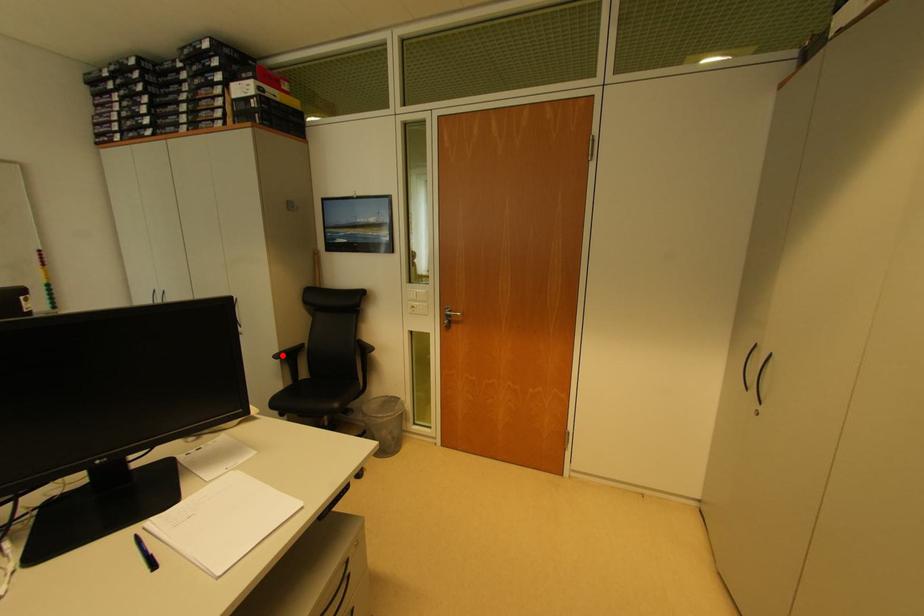
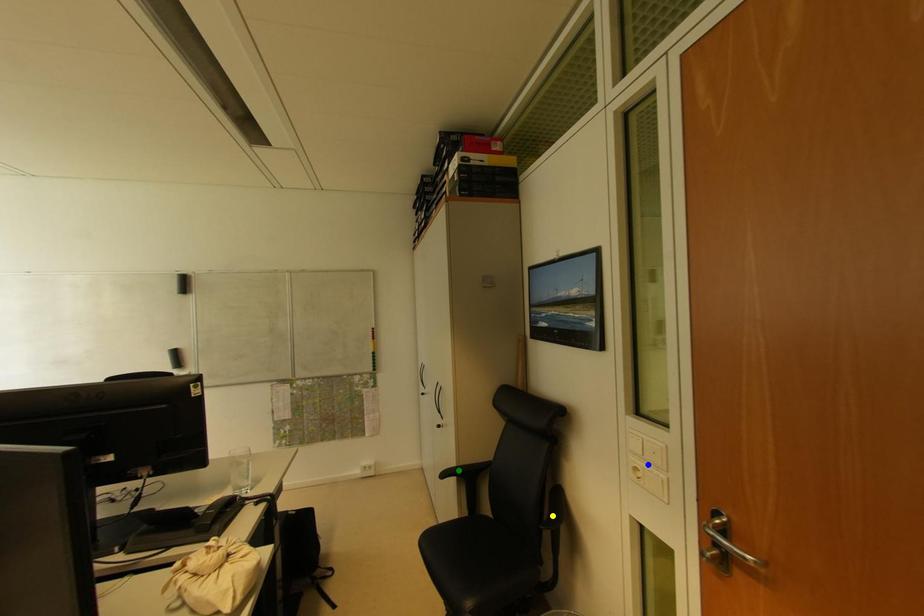
Question: I am providing you with two images of the same scene from different viewpoints. A red point is marked on the first image. You are given multiple points on the second image. In image 2, which mark is for the same physical point as the one in image 1?

Choices:
 (A) blue point
 (B) green point
 (C) yellow point

Answer: (B)